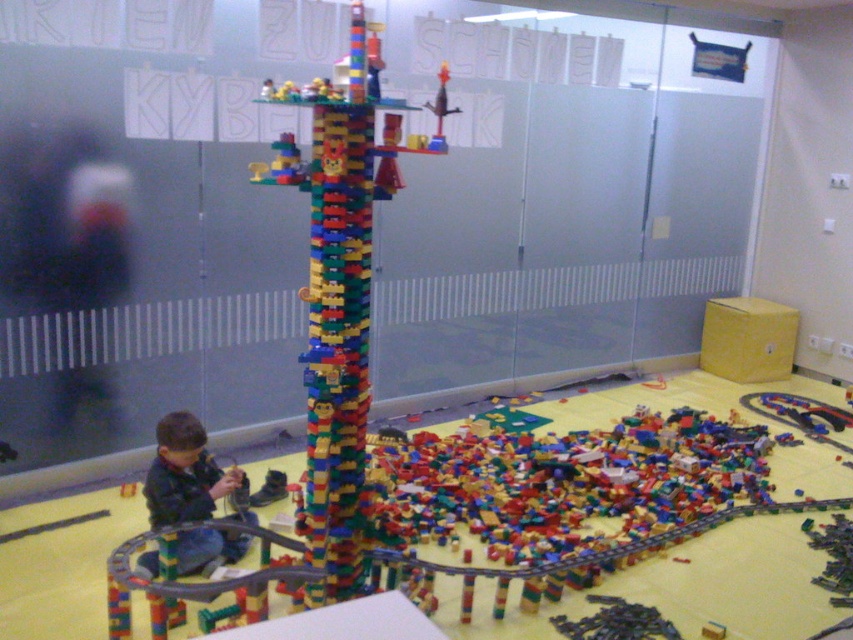
Question: Can you confirm if multicolored plastic tower at center is bigger than dark blue denim jacket at lower left?

Choices:
 (A) yes
 (B) no

Answer: (A)

Question: Can you confirm if multicolored plastic tower at center is positioned below dark blue denim jacket at lower left?

Choices:
 (A) no
 (B) yes

Answer: (A)

Question: Which object appears closest to the camera in this image?

Choices:
 (A) multicolored plastic tower at center
 (B) dark blue denim jacket at lower left

Answer: (A)

Question: Does multicolored plastic tower at center have a lesser width compared to dark blue denim jacket at lower left?

Choices:
 (A) yes
 (B) no

Answer: (B)

Question: Among these objects, which one is nearest to the camera?

Choices:
 (A) multicolored plastic tower at center
 (B) dark blue denim jacket at lower left

Answer: (A)